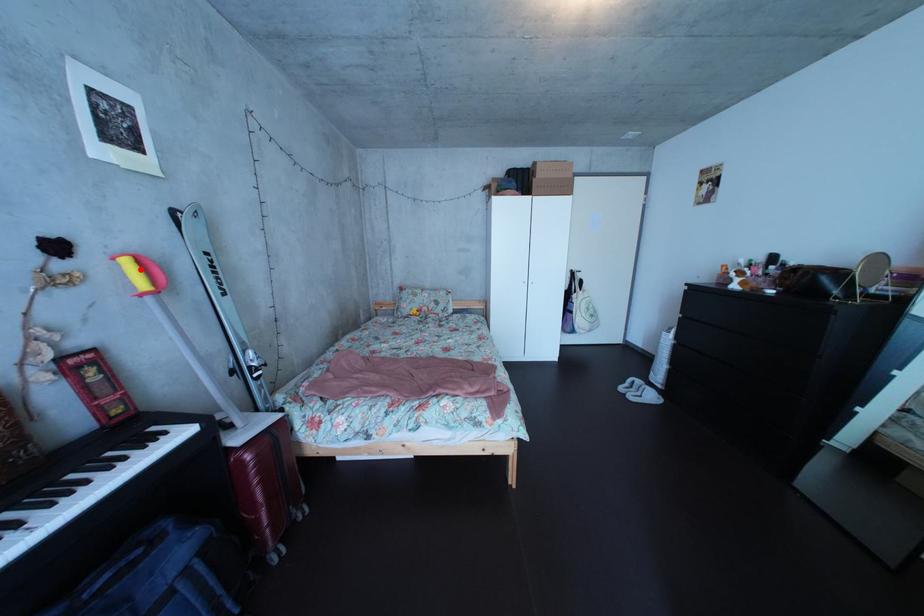
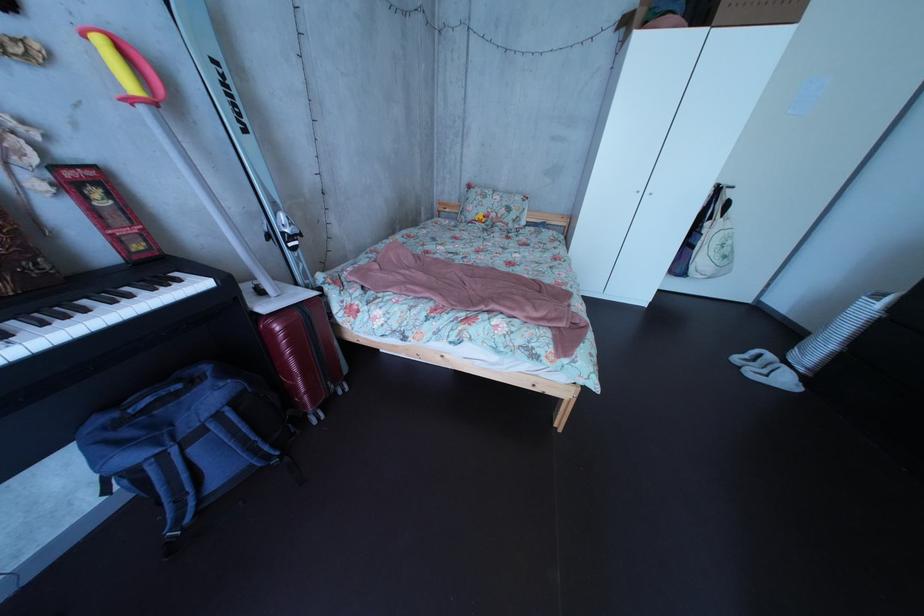
Locate, in the second image, the point that corresponds to the highlighted location in the first image.

(116, 51)